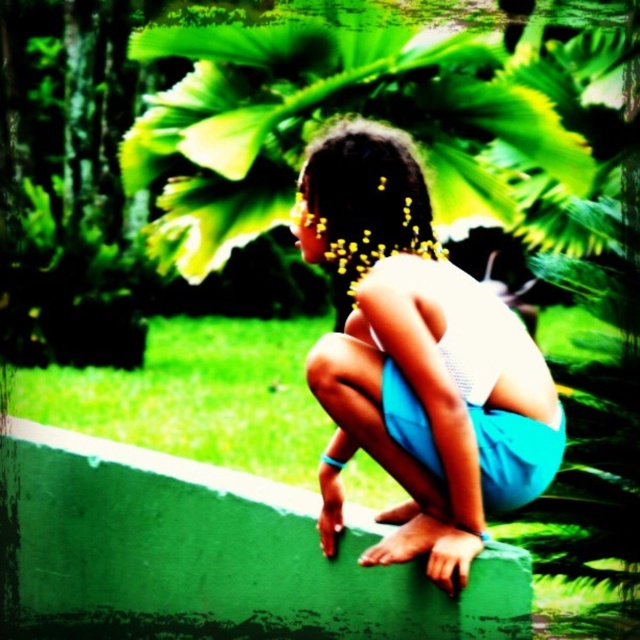
Is the position of white matte shorts at center less distant than that of dark brown hair at center?

Yes, it is in front of dark brown hair at center.

Can you confirm if white matte shorts at center is positioned above dark brown hair at center?

Incorrect, white matte shorts at center is not positioned above dark brown hair at center.

Measure the distance between white matte shorts at center and camera.

white matte shorts at center is 2.66 meters from camera.

Identify the location of white matte shorts at center. The height and width of the screenshot is (640, 640). (417, 360).